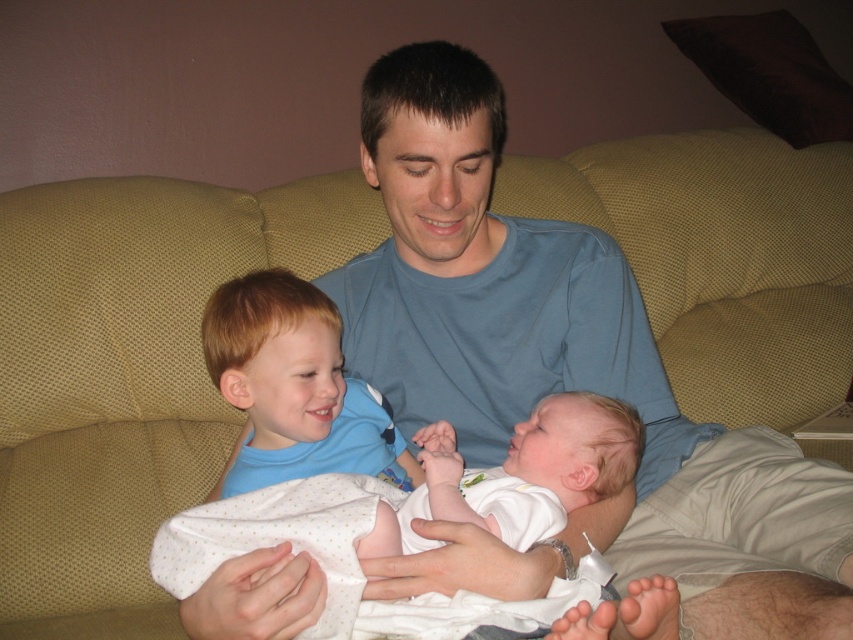
Based on the scene description, can you determine which object has a bigger size between the white soft fabric baby at center and the blue cotton shirt at center?

The white soft fabric baby at center has a larger size compared to the blue cotton shirt at center according to the description.

You are standing in the living room and want to place two decorative items on the sofa. The first item should be placed at point (x=352, y=518) and the second at point (x=334, y=348). Which point is closer to you?

Point (x=352, y=518) is closer to the viewer than point (x=334, y=348).